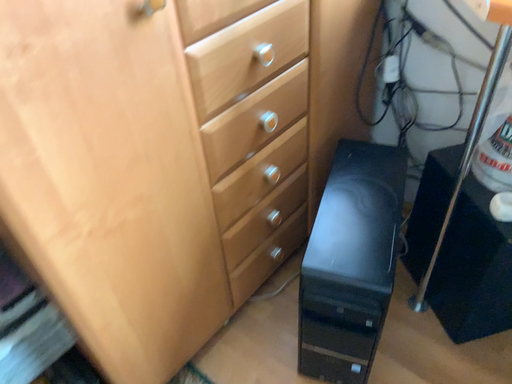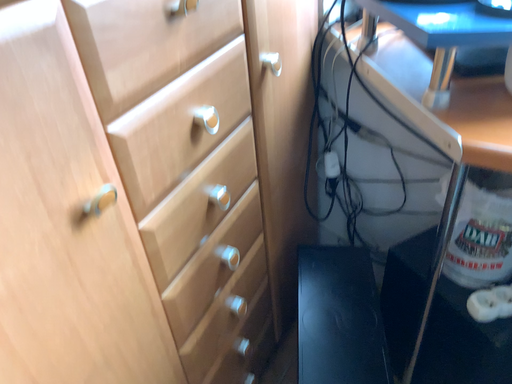
Question: Which way did the camera rotate in the video?

Choices:
 (A) rotated right
 (B) rotated left

Answer: (A)